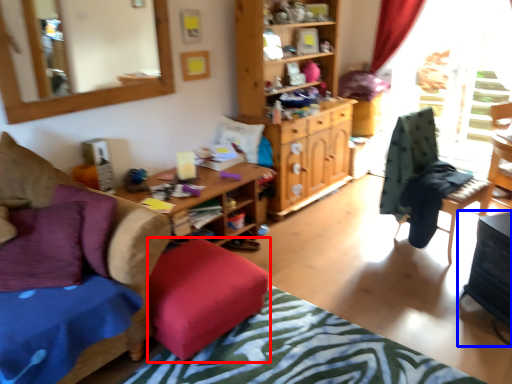
Question: Which of the following is the closest to the observer, stool (highlighted by a red box) or table (highlighted by a blue box)?

Choices:
 (A) stool
 (B) table

Answer: (A)